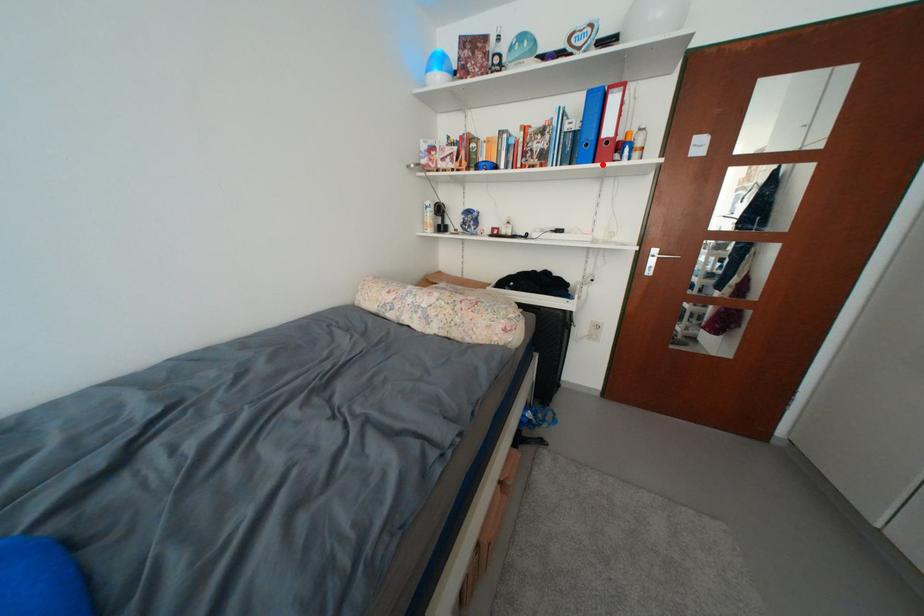
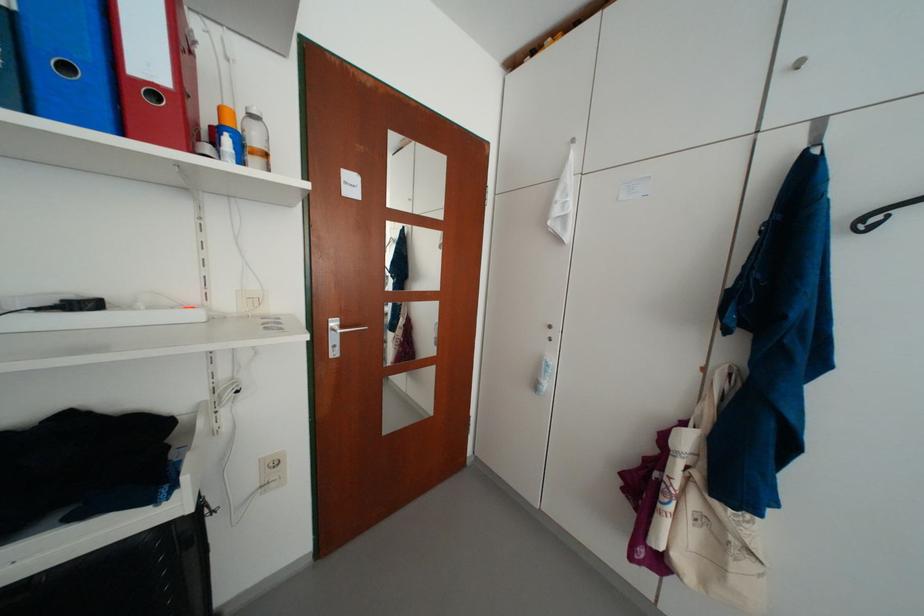
In the second image, find the point that corresponds to the highlighted location in the first image.

(130, 136)